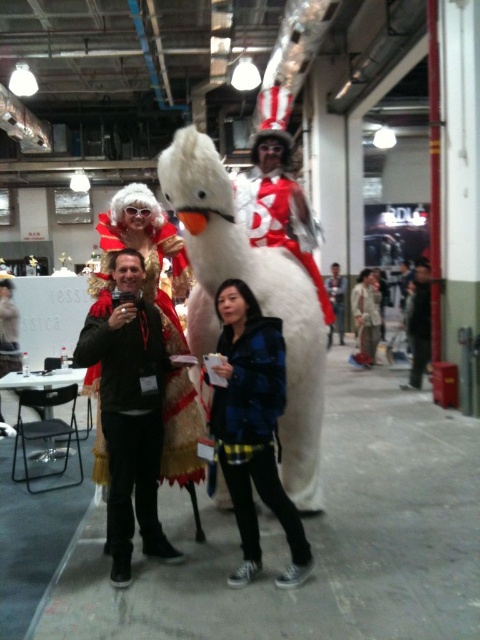
Question: Which is farther from the blue plaid jacket at center?

Choices:
 (A) white plush horse at center
 (B) fuzzy gold dress at center
 (C) dark brown leather jacket at center
 (D) matte gold helmet at center

Answer: (D)

Question: Which object is closer to the camera taking this photo?

Choices:
 (A) blue plaid jacket at center
 (B) fuzzy gold dress at center
 (C) black matte jacket at center

Answer: (A)

Question: Is white plush swan at center further to the viewer compared to blue plaid jacket at center?

Choices:
 (A) no
 (B) yes

Answer: (B)

Question: Which point is closer to the camera?

Choices:
 (A) (280, 408)
 (B) (420, 284)
 (C) (272, 209)

Answer: (A)

Question: Is dark brown leather jacket at center bigger than blue plaid jacket at center?

Choices:
 (A) yes
 (B) no

Answer: (A)

Question: Considering the relative positions of white plush horse at center and fuzzy white costume at center in the image provided, where is white plush horse at center located with respect to fuzzy white costume at center?

Choices:
 (A) below
 (B) above

Answer: (B)